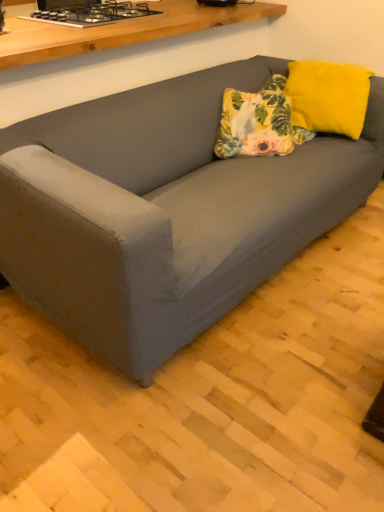
Question: Relative to yellow fuzzy pillow at upper right, is suede gray couch at center in front or behind?

Choices:
 (A) front
 (B) behind

Answer: (A)

Question: Is point (94, 285) closer or farther from the camera than point (365, 74)?

Choices:
 (A) closer
 (B) farther

Answer: (A)

Question: Based on their relative distances, which object is farther from the suede gray couch at center?

Choices:
 (A) black glass stove at upper left
 (B) yellow fuzzy pillow at upper right
 (C) floral fabric pillow at center

Answer: (A)

Question: Which object is the farthest from the black glass stove at upper left?

Choices:
 (A) yellow fuzzy pillow at upper right
 (B) suede gray couch at center
 (C) floral fabric pillow at center

Answer: (A)